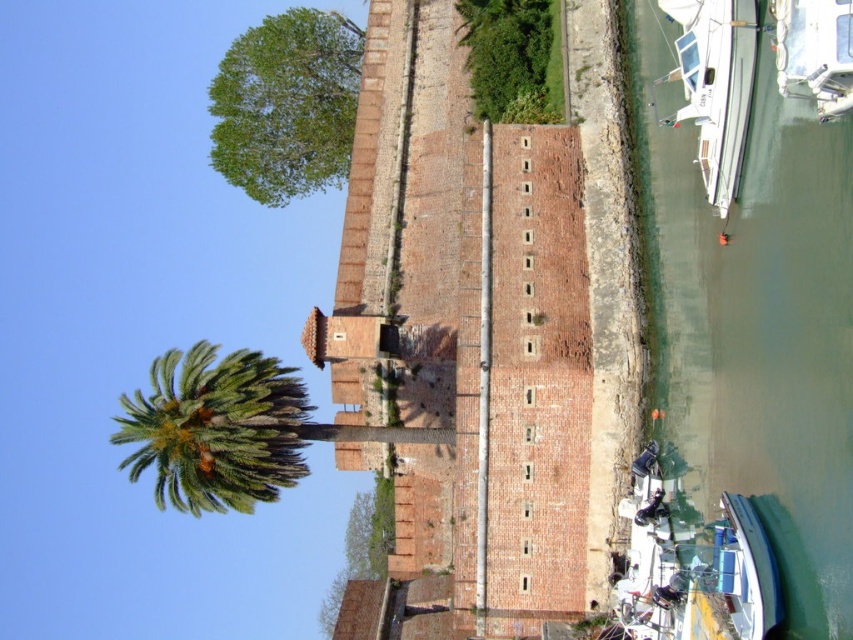
Is green water at right to the right of white glossy boat at upper right from the viewer's perspective?

No, green water at right is not to the right of white glossy boat at upper right.

Which is more to the right, green water at right or white glossy boat at upper right?

white glossy boat at upper right

Is point (799, 474) behind point (828, 13)?

That is True.

Identify the location of green water at right. (753, 323).

Is brick tower at center positioned in front of green leafy tree at center?

Yes, it is.

Is brick tower at center above green leafy tree at center?

Yes.

Describe the element at coordinates (459, 333) in the screenshot. I see `brick tower at center` at that location.

Identify the location of brick tower at center. (459, 333).

Does green leafy palm at left have a lesser width compared to green leafy tree at center?

No.

Can you confirm if green leafy palm at left is shorter than green leafy tree at center?

Indeed, green leafy palm at left has a lesser height compared to green leafy tree at center.

Is point (241, 362) closer to viewer compared to point (386, 490)?

That is True.

Where is `green leafy palm at left`? This screenshot has width=853, height=640. green leafy palm at left is located at coordinates (215, 429).